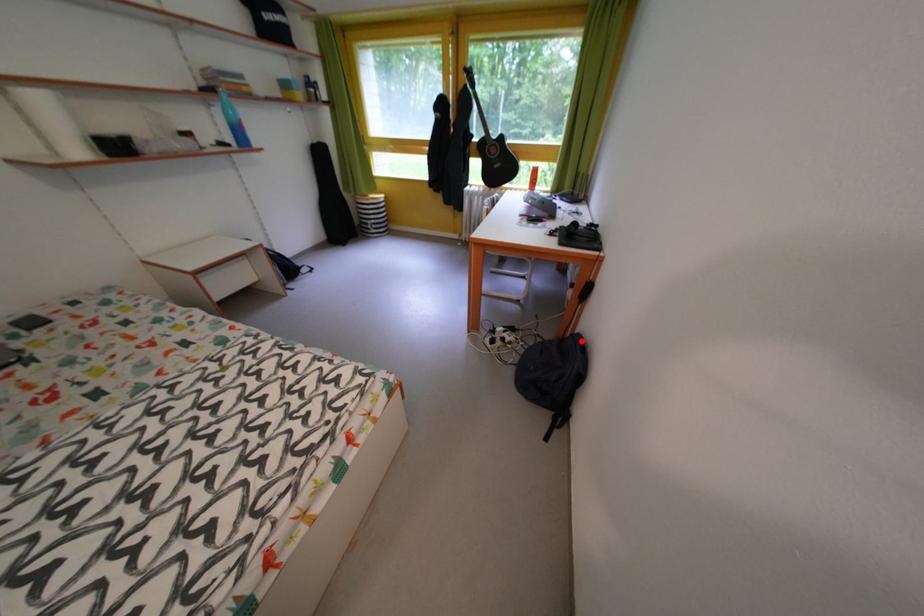
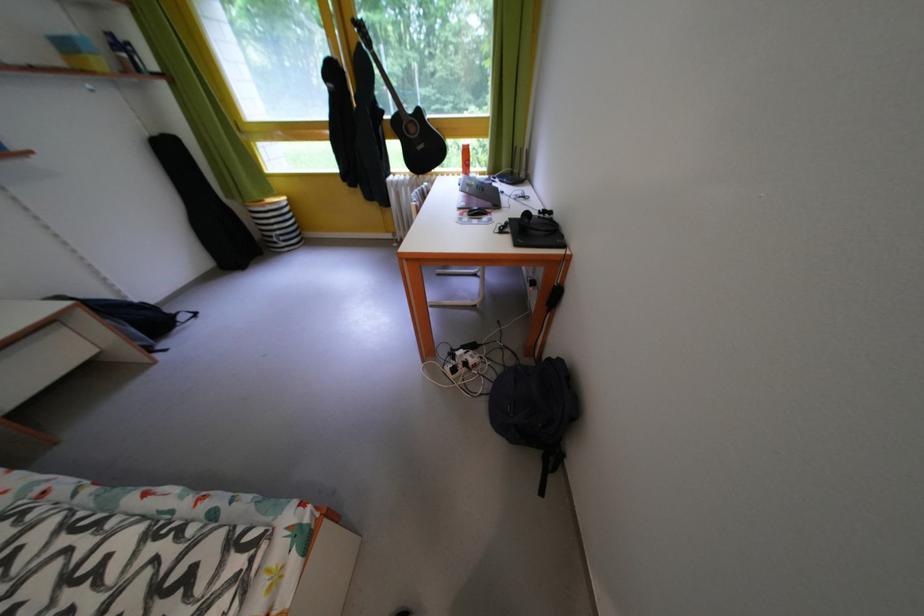
Question: I am providing you with two images of the same scene from different viewpoints. Given a red point in image1, look at the same physical point in image2. Is it:

Choices:
 (A) Closer to the viewpoint
 (B) Farther from the viewpoint

Answer: (B)